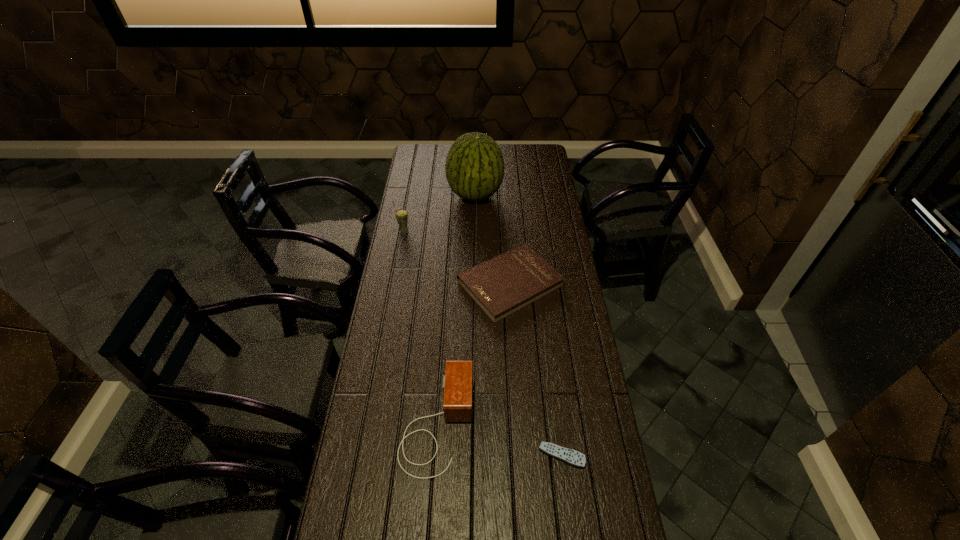
Identify the location of blank space at the far right corner of the desktop. (528, 147).

The image size is (960, 540). I want to click on vacant area that lies between the second farthest object and the remote control, so click(483, 343).

Find the location of a particular element. empty space that is in between the remote control and the fourth tallest object is located at coordinates (536, 369).

Identify the location of free point between the second shortest object and the leftmost object. The image size is (960, 540). (457, 257).

Locate an element on the screen. free space between the farthest object and the remote control is located at coordinates (518, 325).

Where is `free spot between the shortest object and the radio receiver`? free spot between the shortest object and the radio receiver is located at coordinates (499, 440).

I want to click on vacant region between the third nearest object and the third tallest object, so click(473, 353).

This screenshot has height=540, width=960. In order to click on free area in between the hardback book and the tallest object in this screenshot , I will do `click(492, 239)`.

You are a GUI agent. You are given a task and a screenshot of the screen. Output one action in this format:
    pyautogui.click(x=<x>, y=<y>)
    Task: Click on the vacant area between the farthest object and the leftmost object
    This screenshot has width=960, height=540.
    Given the screenshot: What is the action you would take?
    pyautogui.click(x=440, y=213)

The height and width of the screenshot is (540, 960). Identify the location of vacant space that's between the radio receiver and the fourth shortest object. [420, 327].